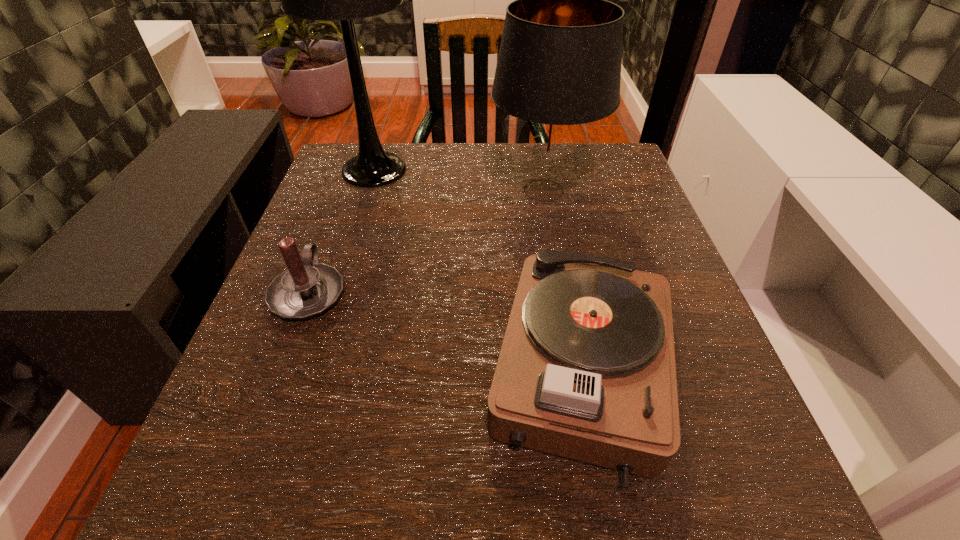
The height and width of the screenshot is (540, 960). I want to click on free spot at the far edge of the desktop, so click(x=478, y=194).

You are a GUI agent. You are given a task and a screenshot of the screen. Output one action in this format:
    pyautogui.click(x=<x>, y=<y>)
    Task: Click on the vacant space at the left edge of the desktop
    
    Given the screenshot: What is the action you would take?
    pyautogui.click(x=355, y=324)

The width and height of the screenshot is (960, 540). Find the location of `free space at the right edge of the desktop`. free space at the right edge of the desktop is located at coordinates (647, 258).

This screenshot has height=540, width=960. In order to click on vacant space at the far left corner of the desktop in this screenshot , I will do `click(396, 150)`.

This screenshot has height=540, width=960. I want to click on vacant space at the near left corner of the desktop, so click(258, 531).

The height and width of the screenshot is (540, 960). Identify the location of vacant space at the far right corner of the desktop. (622, 165).

I want to click on free region at the near right corner, so click(x=787, y=510).

This screenshot has height=540, width=960. Find the location of `free space between the tallest object and the lampshade`. free space between the tallest object and the lampshade is located at coordinates (459, 180).

Where is `free area in between the candle and the lampshade`? This screenshot has width=960, height=540. free area in between the candle and the lampshade is located at coordinates (426, 241).

Identify the location of vacant space that's between the third shortest object and the table lamp. (459, 180).